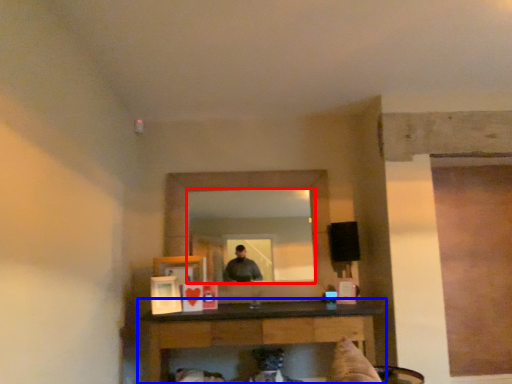
Question: Among these objects, which one is farthest to the camera, mirror (highlighted by a red box) or table (highlighted by a blue box)?

Choices:
 (A) mirror
 (B) table

Answer: (A)